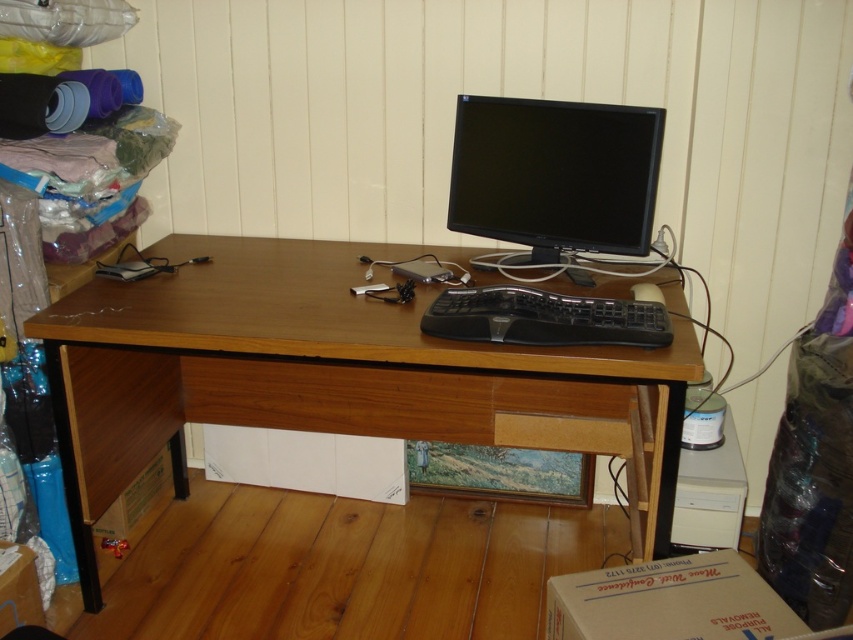
Can you confirm if wooden computer desk at center is thinner than white cardboard box at lower right?

Incorrect, wooden computer desk at center's width is not less than white cardboard box at lower right's.

Where is `wooden computer desk at center`? The height and width of the screenshot is (640, 853). wooden computer desk at center is located at coordinates point(329,376).

How distant is black plastic keyboard at center from brown cardboard box at lower left?

black plastic keyboard at center is 4.21 feet away from brown cardboard box at lower left.

Is black plastic keyboard at center above brown cardboard box at lower left?

Yes.

Between point (448, 292) and point (125, 516), which one is positioned behind?

Point (125, 516)

Where is `black plastic keyboard at center`? black plastic keyboard at center is located at coordinates (544, 317).

Who is taller, brown cardboard box at lower left or cardboard box at lower left?

brown cardboard box at lower left

In the scene shown: Which of these two, brown cardboard box at lower left or cardboard box at lower left, stands shorter?

cardboard box at lower left is shorter.

Which is in front, point (165, 449) or point (33, 624)?

Point (33, 624) is in front.

I want to click on brown cardboard box at lower left, so click(x=136, y=500).